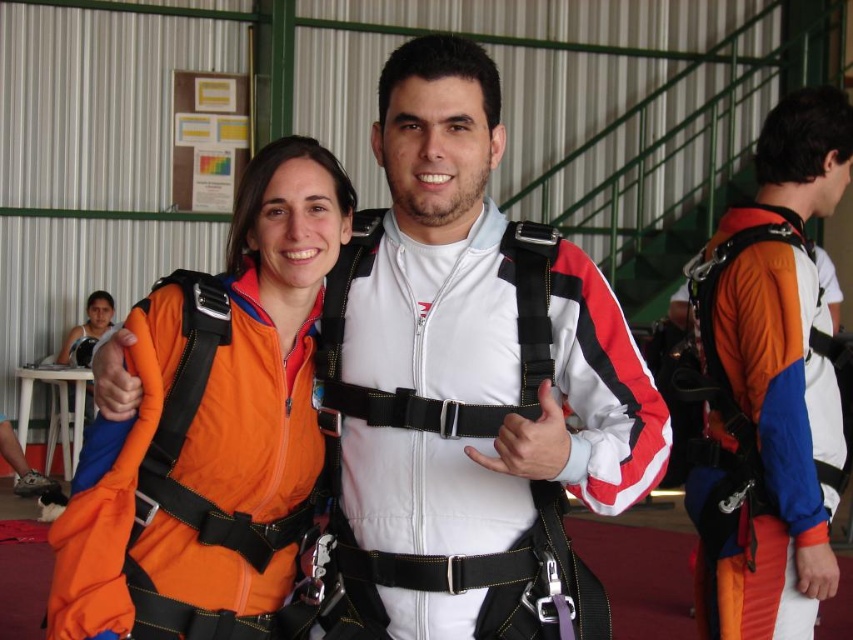
Question: Does white matte jumpsuit at center appear on the right side of orange fabric jumpsuit at right?

Choices:
 (A) yes
 (B) no

Answer: (B)

Question: Can you confirm if white matte jumpsuit at center is positioned to the left of orange fabric jumpsuit at center?

Choices:
 (A) no
 (B) yes

Answer: (A)

Question: Estimate the real-world distances between objects in this image. Which object is farther from the orange fabric jumpsuit at center?

Choices:
 (A) orange fabric jumpsuit at right
 (B) white matte jumpsuit at center

Answer: (A)

Question: Can you confirm if white matte jumpsuit at center is smaller than orange fabric jumpsuit at right?

Choices:
 (A) yes
 (B) no

Answer: (A)

Question: Which of these objects is positioned farthest from the orange fabric jumpsuit at right?

Choices:
 (A) white matte jumpsuit at center
 (B) orange fabric jumpsuit at center

Answer: (B)

Question: Based on their relative distances, which object is nearer to the orange fabric jumpsuit at right?

Choices:
 (A) white matte jumpsuit at center
 (B) orange fabric jumpsuit at center

Answer: (A)